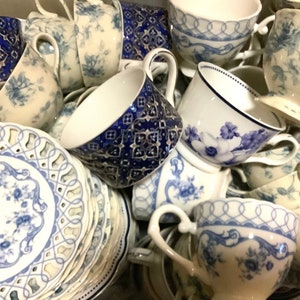
The width and height of the screenshot is (300, 300). Find the location of `handle`. handle is located at coordinates (141, 260), (164, 210), (287, 142), (241, 175), (172, 92), (264, 23), (45, 12), (245, 53), (125, 65), (38, 41).